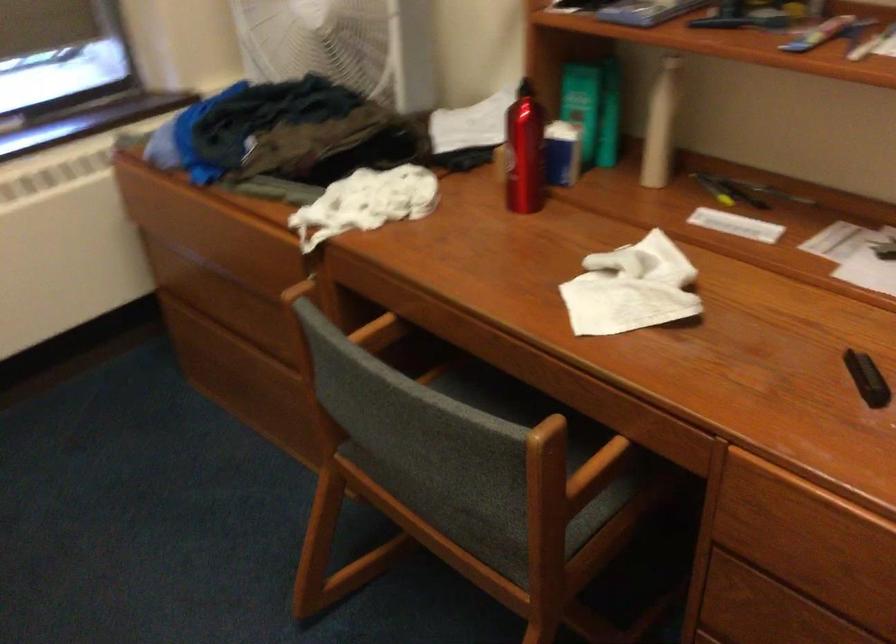
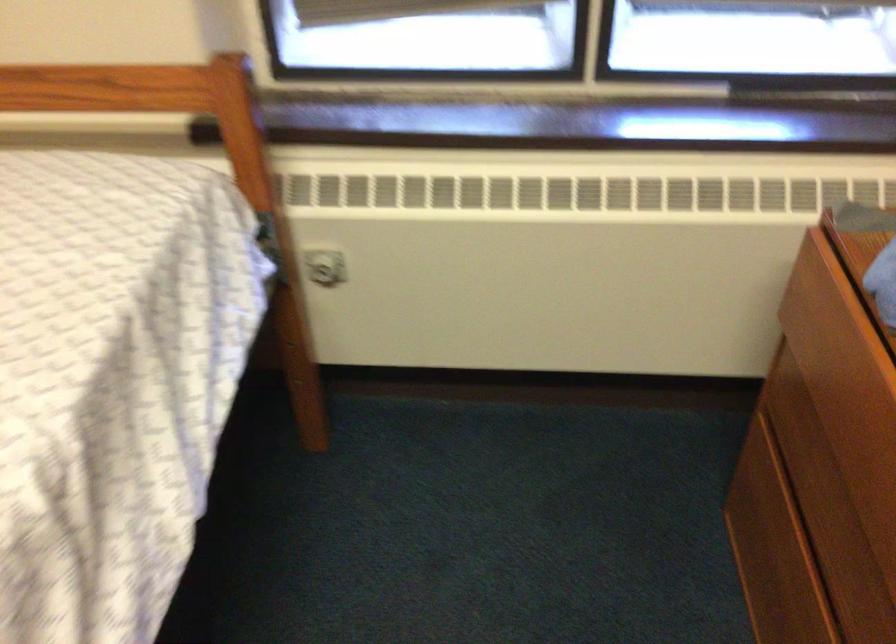
The images are taken continuously from a first-person perspective. In which direction is your viewpoint rotating?

The camera's rotation is toward left-down.